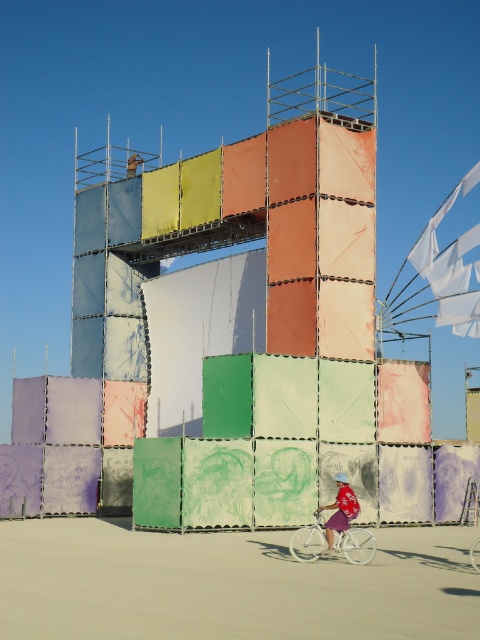
Is white matte bicycle at lower center closer to the viewer compared to matte pink dress at lower right?

Yes, it is in front of matte pink dress at lower right.

Can you confirm if white matte bicycle at lower center is positioned above matte pink dress at lower right?

→ No.

Between point (296, 552) and point (336, 518), which one is positioned behind?

The point (296, 552) is behind.

At what (x,y) coordinates should I click in order to perform the action: click on white matte bicycle at lower center. Please return your answer as a coordinate pair (x, y). Image resolution: width=480 pixels, height=640 pixels. Looking at the image, I should click on (309, 540).

Is point (307, 528) positioned after point (478, 552)?

Yes, it is behind point (478, 552).

The image size is (480, 640). In order to click on white matte bicycle at lower center in this screenshot , I will do `click(309, 540)`.

Consider the image. Which is more to the right, matte pink dress at lower right or white matte bicycle at center?

Positioned to the right is white matte bicycle at center.

Is point (338, 518) positioned before point (476, 561)?

No, (338, 518) is behind (476, 561).

Who is more forward, (322, 506) or (470, 561)?

Point (470, 561)

Where is `matte pink dress at lower right`? The width and height of the screenshot is (480, 640). matte pink dress at lower right is located at coordinates (340, 509).